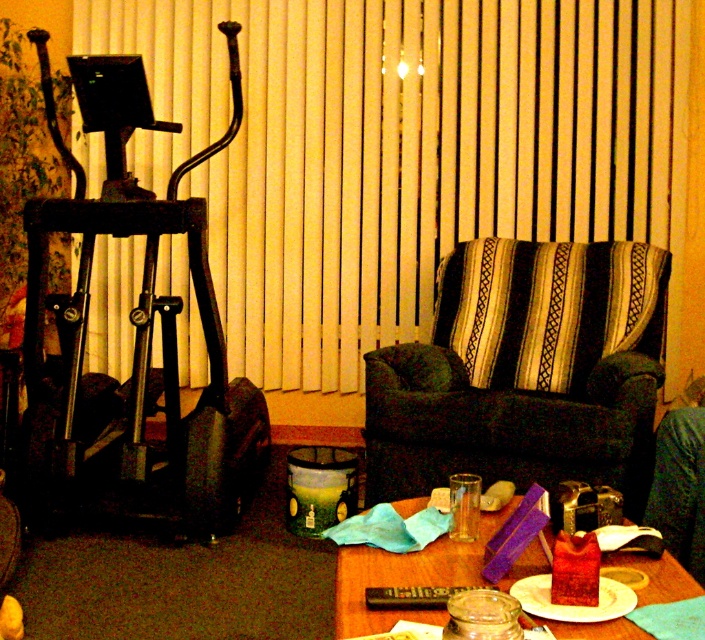
You are trying to decide whether to place a tall potted plant between the dark green fabric armchair at center and the metallic black elliptical trainer at left. Based on their heights, which object should the plant be placed closer to?

The dark green fabric armchair at center is not as tall as the metallic black elliptical trainer at left, so the plant should be placed closer to the metallic black elliptical trainer at left to maintain a balanced arrangement.

You are sitting in the dark green fabric armchair at center and want to reach the metallic black elliptical trainer at left. Which direction should you move to get closer to it?

Since the dark green fabric armchair at center is closer to the viewer than the metallic black elliptical trainer at left, you would need to move towards the left to get closer to the trainer.

You are organizing the living room and need to place a new plant on the translucent glass jar at center. However, you notice the yellow fabric blind at upper center. Will the blind block sunlight from reaching the plant if placed there?

The yellow fabric blind at upper center is positioned over the translucent glass jar at center, so it will block some sunlight from reaching the plant placed on the jar.